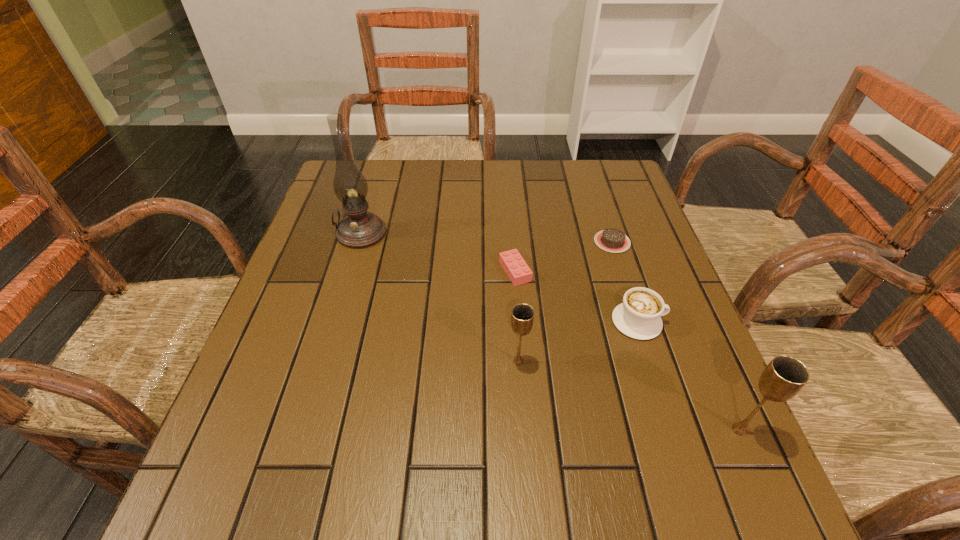
The image size is (960, 540). I want to click on the fourth tallest object, so pyautogui.click(x=638, y=316).

This screenshot has height=540, width=960. In order to click on free space located on the right of the left chalice in this screenshot , I will do `click(670, 362)`.

I want to click on blank space located on the left of the right chalice, so click(564, 430).

This screenshot has width=960, height=540. I want to click on free spot located 0.400m on the left of the third farthest object, so click(x=331, y=271).

You are a GUI agent. You are given a task and a screenshot of the screen. Output one action in this format:
    pyautogui.click(x=<x>, y=<y>)
    Task: Click on the vacant space located 0.160m on the back of the shortest object
    The height and width of the screenshot is (540, 960).
    Given the screenshot: What is the action you would take?
    pyautogui.click(x=597, y=195)

The image size is (960, 540). What are the coordinates of `vacant space situated on the front of the tallest object` in the screenshot? It's located at (322, 364).

Locate an element on the screen. This screenshot has width=960, height=540. object that is at the near edge is located at coordinates (x=784, y=376).

You are a GUI agent. You are given a task and a screenshot of the screen. Output one action in this format:
    pyautogui.click(x=<x>, y=<y>)
    Task: Click on the object present at the left edge
    This screenshot has height=540, width=960.
    Given the screenshot: What is the action you would take?
    pyautogui.click(x=359, y=229)

Locate an element on the screen. Image resolution: width=960 pixels, height=540 pixels. chalice situated at the right edge is located at coordinates (784, 376).

The width and height of the screenshot is (960, 540). What are the coordinates of `chocolate cake positioned at the right edge` in the screenshot? It's located at (613, 240).